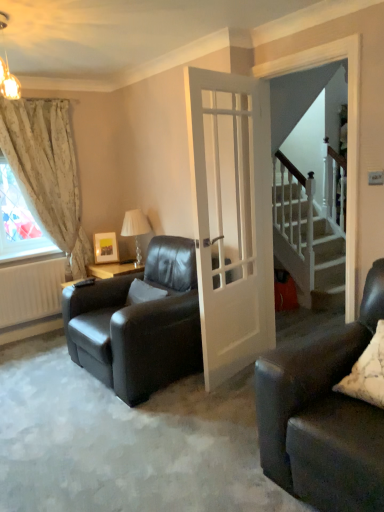
Measure the distance between white matte radiator at lower left and camera.

The distance of white matte radiator at lower left from camera is 12.19 feet.

The image size is (384, 512). What do you see at coordinates (135, 230) in the screenshot? I see `white glass lamp at center` at bounding box center [135, 230].

This screenshot has width=384, height=512. What do you see at coordinates (105, 247) in the screenshot? I see `matte wooden picture frame at upper left` at bounding box center [105, 247].

Find the location of a particular element. The width and height of the screenshot is (384, 512). white matte radiator at lower left is located at coordinates (30, 291).

Are floral fabric curtain at left and white soft pillow at center, placed as the second pillow when sorted from front to back, located far from each other?

That's right, there is a large distance between floral fabric curtain at left and white soft pillow at center, placed as the second pillow when sorted from front to back.

From the image's perspective, is floral fabric curtain at left on white soft pillow at center, positioned as the second pillow in right-to-left order?

Yes, from the image's perspective, floral fabric curtain at left is over white soft pillow at center, positioned as the second pillow in right-to-left order.

Is the position of floral fabric curtain at left less distant than that of white soft pillow at center, the first pillow when ordered from back to front?

No, floral fabric curtain at left is further to the viewer.

Is white soft pillow at center, the first pillow when ordered from back to front, located within floral fabric curtain at left?

No, floral fabric curtain at left does not contain white soft pillow at center, the first pillow when ordered from back to front.

Which object is closer to the camera, white glossy door at center or white matte radiator at lower left?

white glossy door at center is more forward.

Would you say white glossy door at center contains white matte radiator at lower left?

No, white matte radiator at lower left is not inside white glossy door at center.

Does white glossy door at center appear on the left side of white matte radiator at lower left?

No, white glossy door at center is not to the left of white matte radiator at lower left.

From the image's perspective, is white glossy door at center located above or below white matte radiator at lower left?

Based on their image positions, white glossy door at center is located above white matte radiator at lower left.

From the image's perspective, between floral fabric curtain at left and white glass lamp at center, which one is located above?

floral fabric curtain at left is shown above in the image.

Considering the positions of objects floral fabric curtain at left and white glass lamp at center in the image provided, who is more to the left, floral fabric curtain at left or white glass lamp at center?

From the viewer's perspective, floral fabric curtain at left appears more on the left side.

Does point (47, 189) appear closer or farther from the camera than point (139, 214)?

Point (47, 189).

Does floral fabric curtain at left touch white glass lamp at center?

floral fabric curtain at left and white glass lamp at center are not in contact.

Does point (145, 284) come farther from viewer compared to point (96, 239)?

That is False.

Who is taller, white soft pillow at center, placed as the second pillow when sorted from front to back, or matte wooden picture frame at upper left?

With more height is matte wooden picture frame at upper left.

Are white soft pillow at center, positioned as the second pillow in right-to-left order, and matte wooden picture frame at upper left located far from each other?

white soft pillow at center, positioned as the second pillow in right-to-left order, is near matte wooden picture frame at upper left, not far away.

The height and width of the screenshot is (512, 384). I want to click on pillow above the white soft pillow at center, placed as the second pillow when sorted from front to back (from a real-world perspective), so click(x=367, y=373).

From a real-world perspective, is white soft pillow at center, positioned as the second pillow in right-to-left order, on top of white textured pillow at lower right, the second pillow positioned from the left?

No, from a real-world perspective, white soft pillow at center, positioned as the second pillow in right-to-left order, is not above white textured pillow at lower right, the second pillow positioned from the left.

Is the surface of white soft pillow at center, the first pillow when ordered from back to front, in direct contact with white textured pillow at lower right, marked as the second pillow in a back-to-front arrangement?

No, white soft pillow at center, the first pillow when ordered from back to front, is not beside white textured pillow at lower right, marked as the second pillow in a back-to-front arrangement.

Is white soft pillow at center, positioned as the second pillow in right-to-left order, facing away from white textured pillow at lower right, the second pillow positioned from the left?

No, white soft pillow at center, positioned as the second pillow in right-to-left order, is not facing the opposite direction of white textured pillow at lower right, the second pillow positioned from the left.

In the image, there is a white textured pillow at lower right, arranged as the first pillow when viewed from the right. At what (x,y) coordinates should I click in order to perform the action: click on light fixture above it (from the image's perspective). Please return your answer as a coordinate pair (x, y). This screenshot has width=384, height=512. Looking at the image, I should click on (8, 82).

Does matte gold chandelier at upper left appear on the left side of white textured pillow at lower right, the second pillow positioned from the left?

Correct, you'll find matte gold chandelier at upper left to the left of white textured pillow at lower right, the second pillow positioned from the left.

From the image's perspective, is matte gold chandelier at upper left over white textured pillow at lower right, the 1th pillow viewed from the front?

Yes, from the image's perspective, matte gold chandelier at upper left is on top of white textured pillow at lower right, the 1th pillow viewed from the front.

Is matte gold chandelier at upper left facing away from white textured pillow at lower right, arranged as the first pillow when viewed from the right?

No, matte gold chandelier at upper left's orientation is not away from white textured pillow at lower right, arranged as the first pillow when viewed from the right.

From the image's perspective, does matte wooden picture frame at upper left appear higher than white textured pillow at lower right, the 1th pillow viewed from the front?

Yes, from the image's perspective, matte wooden picture frame at upper left is above white textured pillow at lower right, the 1th pillow viewed from the front.

Who is taller, matte wooden picture frame at upper left or white textured pillow at lower right, the second pillow positioned from the left?

With more height is white textured pillow at lower right, the second pillow positioned from the left.

Which object is closer to the camera taking this photo, matte wooden picture frame at upper left or white textured pillow at lower right, the 1th pillow viewed from the front?

white textured pillow at lower right, the 1th pillow viewed from the front, is closer to the camera.

Is matte wooden picture frame at upper left far from white textured pillow at lower right, marked as the second pillow in a back-to-front arrangement?

matte wooden picture frame at upper left is positioned a significant distance from white textured pillow at lower right, marked as the second pillow in a back-to-front arrangement.

At what (x,y) coordinates should I click in order to perform the action: click on pillow that is the 1st one when counting forward from the floral fabric curtain at left. Please return your answer as a coordinate pair (x, y). The height and width of the screenshot is (512, 384). Looking at the image, I should click on (143, 292).

Image resolution: width=384 pixels, height=512 pixels. In order to click on door that appears above the white matte radiator at lower left (from the image's perspective) in this screenshot , I will do tap(231, 217).

Considering their positions, is white matte radiator at lower left positioned closer to white glass lamp at center than white soft pillow at center, the 1th pillow positioned from the left?

white soft pillow at center, the 1th pillow positioned from the left, is closer to white glass lamp at center.

Estimate the real-world distances between objects in this image. Which object is further from white textured pillow at lower right, the 1th pillow viewed from the front, white glass lamp at center or floral fabric curtain at left?

floral fabric curtain at left is positioned further to the anchor white textured pillow at lower right, the 1th pillow viewed from the front.

Estimate the real-world distances between objects in this image. Which object is closer to white matte radiator at lower left, white soft pillow at center, positioned as the second pillow in right-to-left order, or white glass lamp at center?

white glass lamp at center is positioned closer to the anchor white matte radiator at lower left.

Based on their spatial positions, is white glossy door at center or white textured pillow at lower right, the 1th pillow viewed from the front, closer to matte wooden picture frame at upper left?

Answer: Among the two, white glossy door at center is located nearer to matte wooden picture frame at upper left.

Considering their positions, is white soft pillow at center, placed as the second pillow when sorted from front to back, positioned closer to white textured pillow at lower right, marked as the second pillow in a back-to-front arrangement, than matte wooden picture frame at upper left?

white soft pillow at center, placed as the second pillow when sorted from front to back, lies closer to white textured pillow at lower right, marked as the second pillow in a back-to-front arrangement, than the other object.

From the image, which object appears to be farther from white glossy door at center, white matte radiator at lower left or floral fabric curtain at left?

white matte radiator at lower left is positioned further to the anchor white glossy door at center.

Based on their spatial positions, is floral fabric curtain at left or white glass lamp at center closer to matte black armchair at center?

white glass lamp at center is positioned closer to the anchor matte black armchair at center.

From the image, which object appears to be farther from white glossy door at center, white matte radiator at lower left or white soft pillow at center, the 1th pillow positioned from the left?

white matte radiator at lower left is further to white glossy door at center.

Find the location of a particular element. This screenshot has width=384, height=512. light fixture between white matte radiator at lower left and white glossy door at center from left to right is located at coordinates (8, 82).

The width and height of the screenshot is (384, 512). I want to click on door between matte gold chandelier at upper left and white glass lamp at center from front to back, so click(x=231, y=217).

This screenshot has height=512, width=384. In order to click on curtain positioned between white soft pillow at center, the 1th pillow positioned from the left, and matte wooden picture frame at upper left from near to far in this screenshot , I will do `click(47, 170)`.

Identify the location of chair positioned between white glossy door at center and matte wooden picture frame at upper left from near to far. (139, 324).